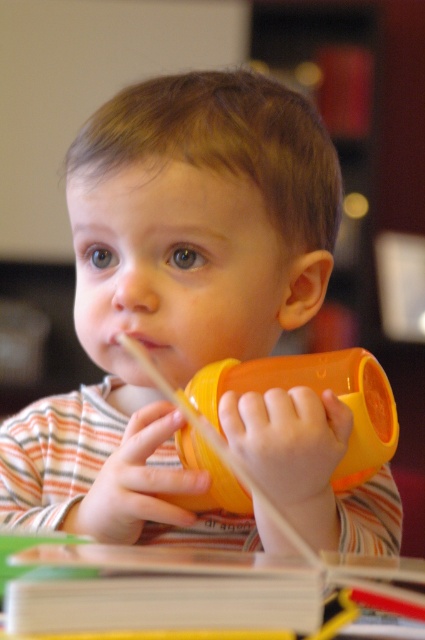
Is orange plastic cup at center smaller than orange matte sippy cup at center?

No, orange plastic cup at center is not smaller than orange matte sippy cup at center.

Looking at this image, between orange plastic cup at center and orange matte sippy cup at center, which one has less height?

With less height is orange matte sippy cup at center.

Which is in front, point (282, 209) or point (203, 371)?

Positioned in front is point (203, 371).

The width and height of the screenshot is (425, 640). In order to click on orange plastic cup at center in this screenshot , I will do `click(172, 291)`.